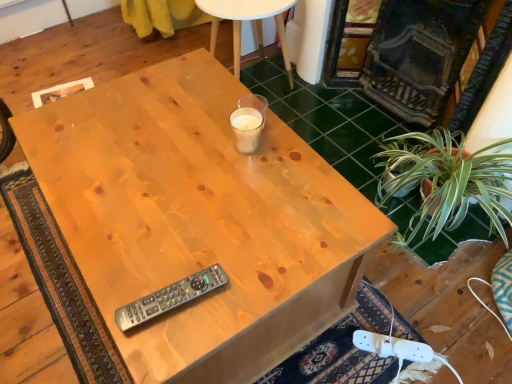
Identify the location of free space in front of translucent glass candle at center, the 2th coffee cup when ordered from top to bottom. (242, 187).